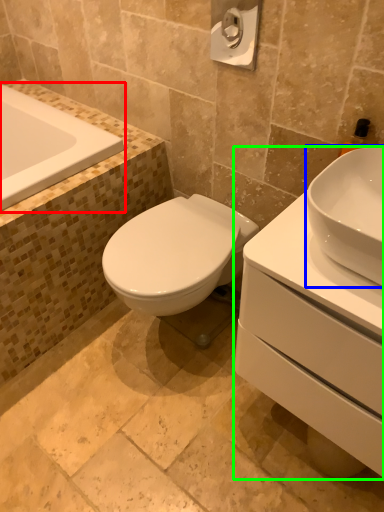
Question: Estimate the real-world distances between objects in this image. Which object is farther from bathtub (highlighted by a red box), sink (highlighted by a blue box) or porcelain (highlighted by a green box)?

Choices:
 (A) sink
 (B) porcelain

Answer: (A)